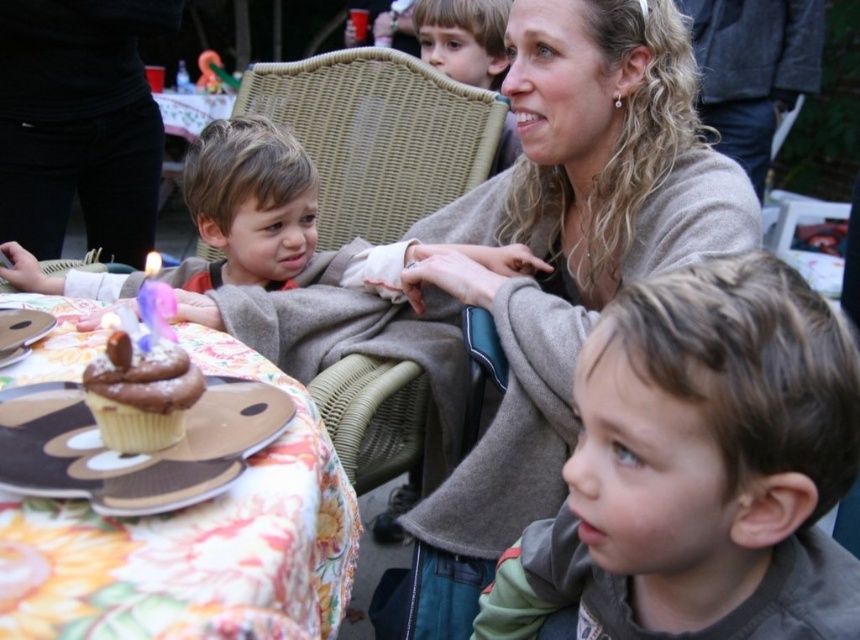
Question: Which of the following is the farthest from the observer?

Choices:
 (A) chocolate cupcake at lower left
 (B) brown fuzzy jacket at center
 (C) chocolate matte cupcake at lower left

Answer: (B)

Question: Which object is closer to the camera taking this photo?

Choices:
 (A) chocolate cupcake at lower left
 (B) chocolate matte cupcake at lower left

Answer: (A)

Question: Is smooth beige sweater at upper center smaller than chocolate cupcake at lower left?

Choices:
 (A) no
 (B) yes

Answer: (A)

Question: Is chocolate cupcake at lower left thinner than chocolate matte cupcake at lower left?

Choices:
 (A) yes
 (B) no

Answer: (B)

Question: Which point is farther to the camera?

Choices:
 (A) chocolate cupcake at lower left
 (B) brown fuzzy jacket at center
 (C) smooth beige sweater at upper center

Answer: (C)

Question: Considering the relative positions of chocolate cupcake at lower left and purple wax candle at center in the image provided, where is chocolate cupcake at lower left located with respect to purple wax candle at center?

Choices:
 (A) above
 (B) below

Answer: (B)